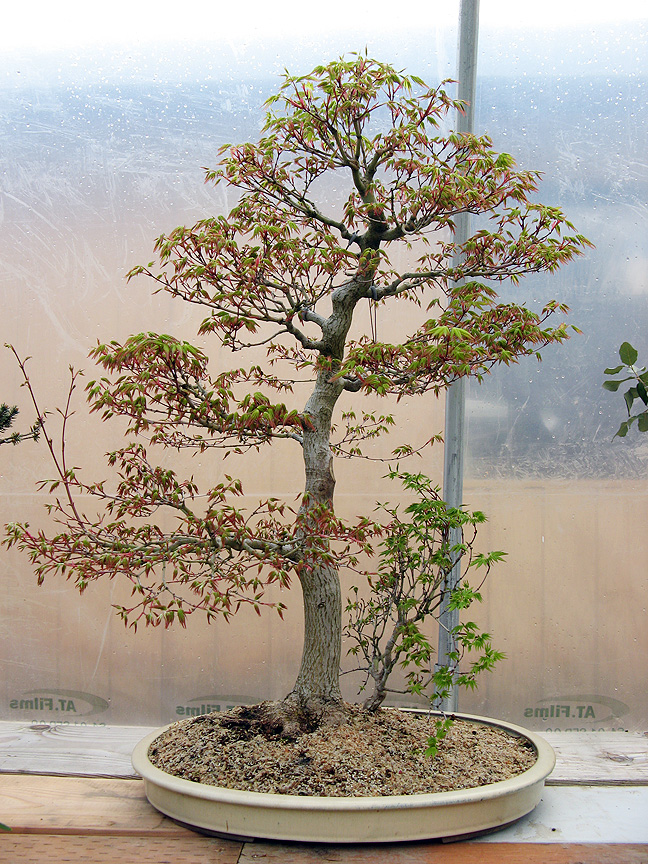
The width and height of the screenshot is (648, 864). Identify the location of grey vertical pipe right of center. (463, 45), (459, 494), (443, 626).